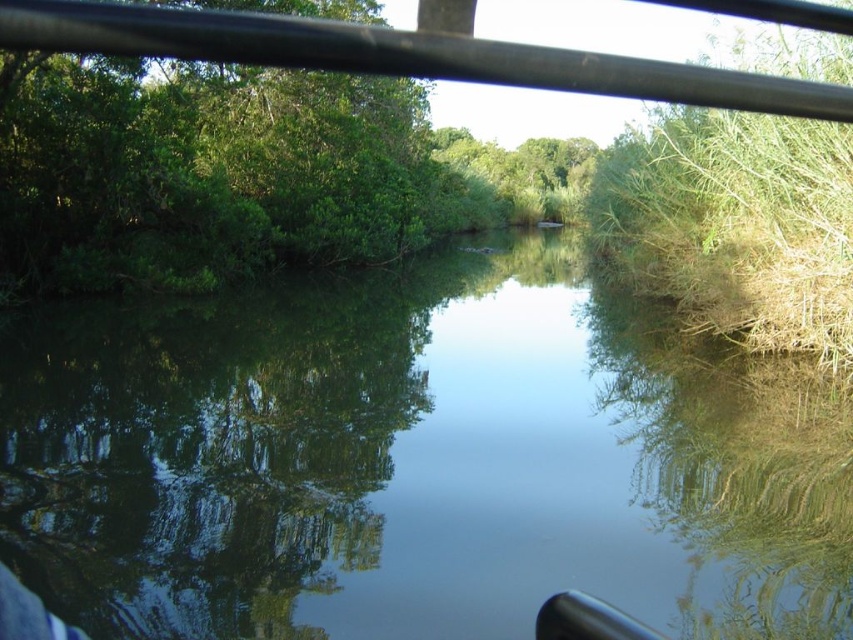
You are standing on the deck of a boat with a 4.5 meter long fishing rod. You want to cast the rod towards the green reflective water at center. Is the distance sufficient to avoid hitting the boat railing behind you?

The green reflective water at center is 5.30 meters away from the viewer. Since the fishing rod is only 4.5 meters long, it is not long enough to reach the water without potentially hitting the boat railing behind you.

You are a photographer trying to capture the reflection of the trees in the water. You notice the green reflective water at center and the black metal rail at upper center. Which object is taller in the image?

The green reflective water at center has a greater height compared to the black metal rail at upper center, so the green reflective water at center is taller in the image.